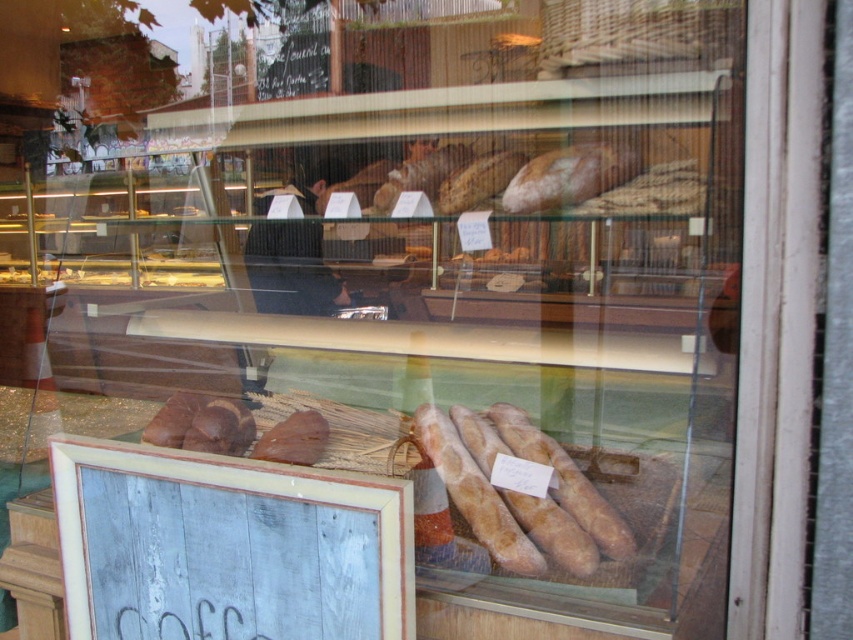
You are a customer looking at the bakery display through the window. You want to read the prices of the bread items. Can you see the wooden signboard at lower left and the golden brown crusty baguette at center clearly from your current position?

The wooden signboard at lower left is closer to the viewer than golden brown crusty baguette at center. Since the signboard is closer, you can read the prices on the wooden signboard at lower left clearly. However, the golden brown crusty baguette at center is farther away, so its price might be less visible unless you move closer.

You are a customer standing in front of the bakery display case. You want to read the wooden signboard at lower left but also want to see the golden brown crusty baguette at center. Can you read the sign and see the baguette at the same time without moving your head?

The wooden signboard at lower left and golden brown crusty baguette at center are 33.18 centimeters apart. Since the distance between them is relatively small, you can likely read the sign and see the baguette simultaneously without moving your head.

You are a customer standing in front of the bakery display case. You see a point marked at coordinate (x=227, y=547). Where is this point located in the scene?

→ The point marked at coordinate (x=227, y=547) is on the wooden signboard at lower left.